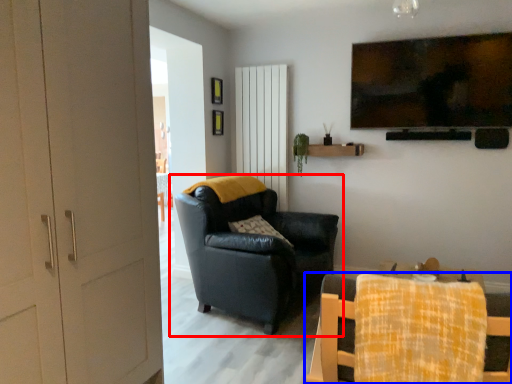
Question: Which object appears closest to the camera in this image, chair (highlighted by a red box) or chair (highlighted by a blue box)?

Choices:
 (A) chair
 (B) chair

Answer: (B)